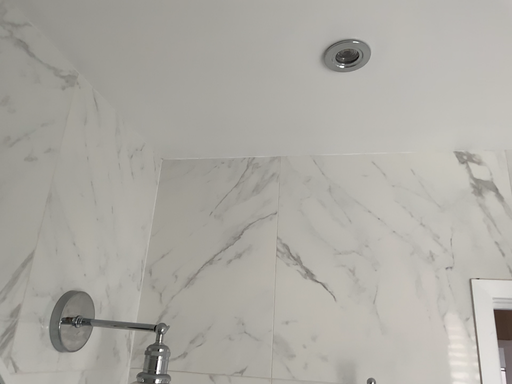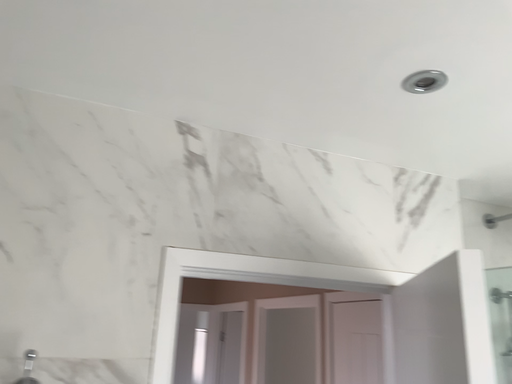
Question: How did the camera likely rotate when shooting the video?

Choices:
 (A) rotated downward
 (B) rotated upward

Answer: (A)